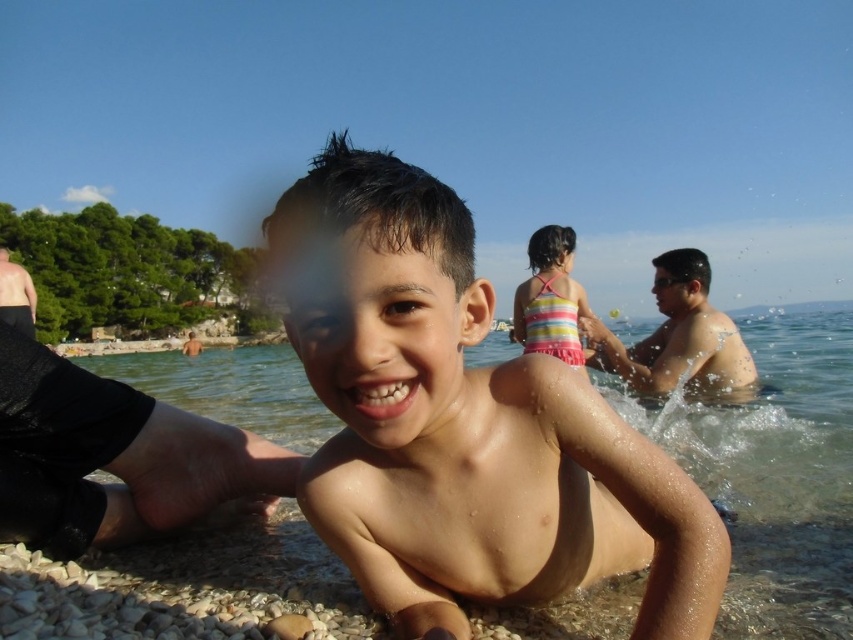
Question: Is clear water at boy front below striped fabric swimsuit at center?

Choices:
 (A) yes
 (B) no

Answer: (A)

Question: Which object appears closest to the camera in this image?

Choices:
 (A) wet skin boy at center
 (B) striped fabric swimsuit at center

Answer: (A)

Question: In this image, where is wet skin boy at center located relative to clear water at boy front?

Choices:
 (A) left
 (B) right

Answer: (A)

Question: Which of the following is the closest to the observer?

Choices:
 (A) (x=799, y=561)
 (B) (x=581, y=358)
 (C) (x=654, y=385)

Answer: (A)

Question: Based on their relative distances, which object is nearer to the smooth skin boy at center?

Choices:
 (A) striped fabric swimsuit at center
 (B) clear water at boy front
 (C) wet skin boy at center

Answer: (A)

Question: Does clear water at boy front have a lesser width compared to smooth skin boy at center?

Choices:
 (A) yes
 (B) no

Answer: (B)